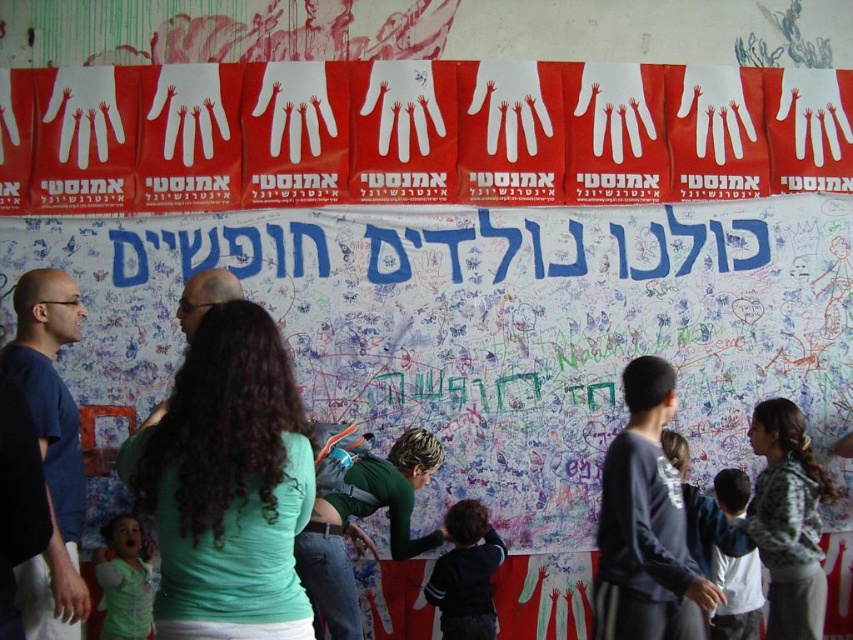
Question: Which object is the closest to the dark gray sweatshirt at center?

Choices:
 (A) green matte shirt at center
 (B) light green shirt at lower left

Answer: (A)

Question: Is green matte shirt at center in front of white cotton shirt at lower right?

Choices:
 (A) yes
 (B) no

Answer: (A)

Question: Which object is farther from the camera taking this photo?

Choices:
 (A) white paper banner at upper center
 (B) red paper banner at upper center
 (C) green matte shirt at center

Answer: (B)

Question: Can you confirm if blue shirt at left is positioned below green fabric shirt at center?

Choices:
 (A) no
 (B) yes

Answer: (A)

Question: Which of these objects is positioned farthest from the light green shirt at lower left?

Choices:
 (A) green matte shirt at center
 (B) red paper banner at upper center

Answer: (B)

Question: Does green fabric shirt at center have a greater width compared to dark blue sweater at center?

Choices:
 (A) no
 (B) yes

Answer: (B)